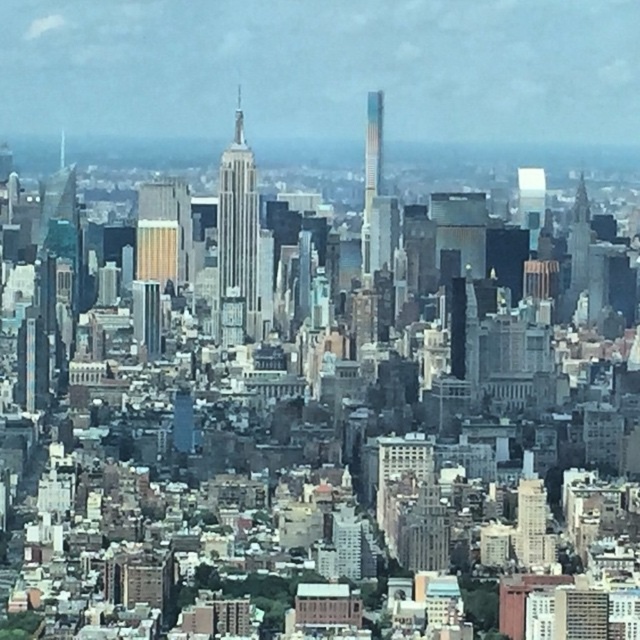
You are an architect analyzing the urban skyline. You notice the white glass skyscraper at center and the multicolored glass skyscraper at center. Which one is located to the left when viewed from the same perspective?

The white glass skyscraper at center is positioned on the left side of the multicolored glass skyscraper at center, so it is located to the left.

You are a city planner analyzing the urban skyline. You need to determine which of the two central skyscrapers is better suited for installing a new high altitude observation deck. The white glass skyscraper at center and the multicolored glass skyscraper at center are both candidates. Based on their height, which one would you recommend?

The white glass skyscraper at center is taller than the multicolored glass skyscraper at center, so it would be better suited for installing a new high altitude observation deck.

You are standing at the point marked by point (x=237, y=232) in the urban skyline image. Which building are you facing?

You are facing the white glass skyscraper at center, as it is represented by point (x=237, y=232).